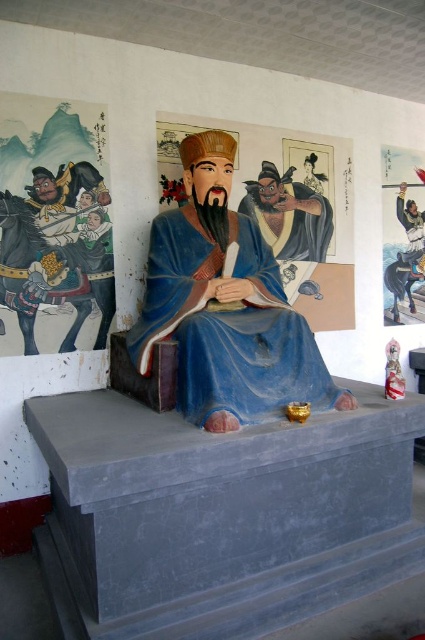
Who is positioned more to the right, blue matte robe at center or matte blue statue at center?

matte blue statue at center is more to the right.

Who is shorter, blue matte robe at center or matte blue statue at center?

Standing shorter between the two is matte blue statue at center.

Measure the distance between point (x=248, y=298) and camera.

The distance of point (x=248, y=298) from camera is 3.22 meters.

Identify the location of blue matte robe at center. (226, 324).